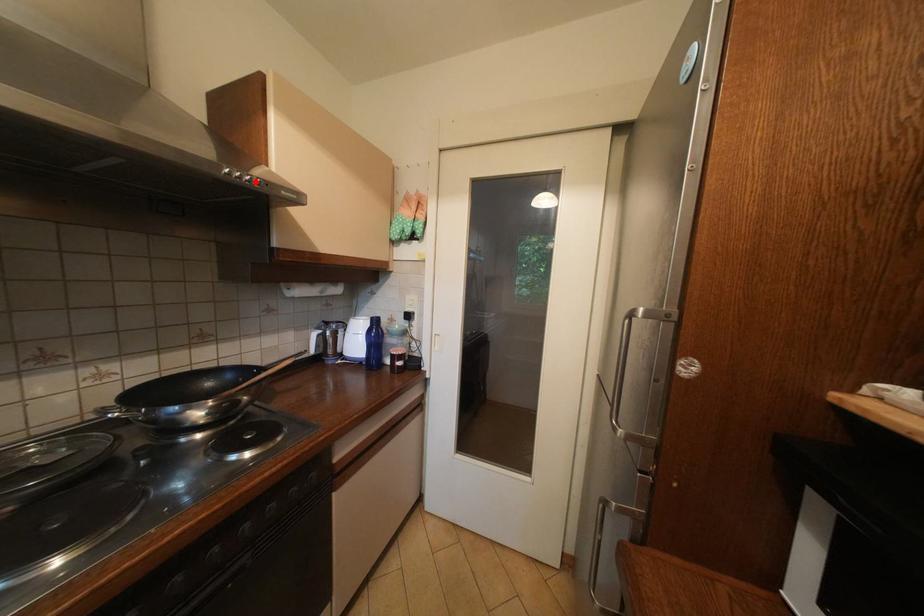
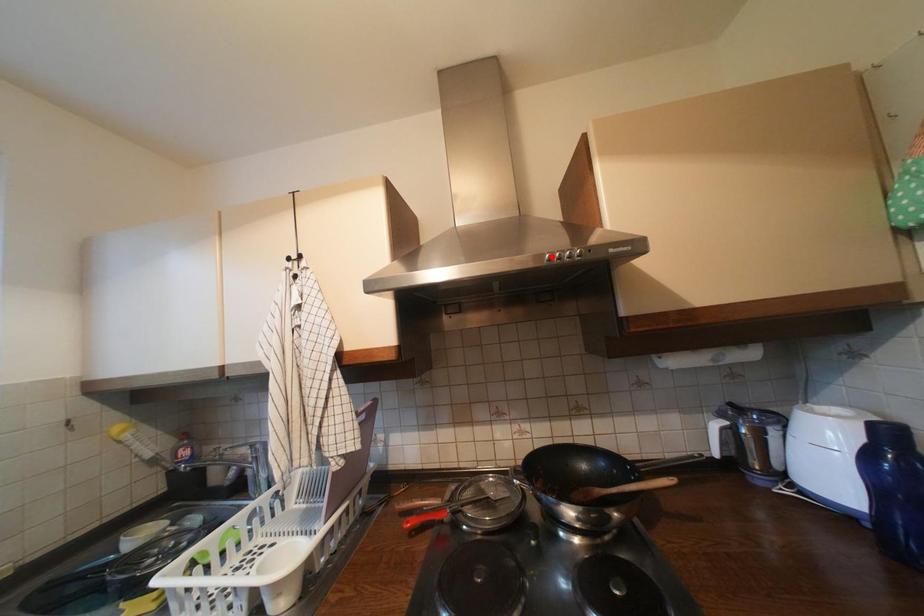
I am providing you with two images of the same scene from different viewpoints. A red point is marked on the first image and another point is marked on the second image. Is the red point in image1 aligned with the point shown in image2?

No